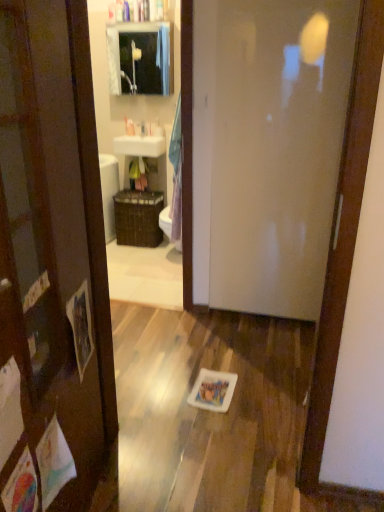
Question: Is white glossy toilet at center not within brown woven basket at center?

Choices:
 (A) yes
 (B) no

Answer: (A)

Question: Is white glossy toilet at center oriented away from brown woven basket at center?

Choices:
 (A) no
 (B) yes

Answer: (A)

Question: Can you confirm if white glossy toilet at center is thinner than brown woven basket at center?

Choices:
 (A) yes
 (B) no

Answer: (A)

Question: From a real-world perspective, is white glossy toilet at center positioned under brown woven basket at center based on gravity?

Choices:
 (A) yes
 (B) no

Answer: (A)

Question: Can you confirm if white glossy toilet at center is wider than brown woven basket at center?

Choices:
 (A) yes
 (B) no

Answer: (B)

Question: From a real-world perspective, is brown woven basket at center above or below white glossy door at center?

Choices:
 (A) below
 (B) above

Answer: (A)

Question: Is brown woven basket at center in front of or behind white glossy door at center in the image?

Choices:
 (A) front
 (B) behind

Answer: (B)

Question: In terms of width, does brown woven basket at center look wider or thinner when compared to white glossy door at center?

Choices:
 (A) wide
 (B) thin

Answer: (A)

Question: Is brown woven basket at center to the left or to the right of white glossy door at center in the image?

Choices:
 (A) left
 (B) right

Answer: (A)

Question: Considering the positions of matte glass mirror at upper center and white plastic cup at upper center, the 1th toiletry when ordered from right to left, in the image, is matte glass mirror at upper center taller or shorter than white plastic cup at upper center, the 1th toiletry when ordered from right to left,?

Choices:
 (A) tall
 (B) short

Answer: (A)

Question: From a real-world perspective, relative to white plastic cup at upper center, the 1th toiletry when ordered from right to left, is matte glass mirror at upper center vertically above or below?

Choices:
 (A) below
 (B) above

Answer: (B)

Question: Considering the positions of point (142, 29) and point (152, 129), is point (142, 29) closer or farther from the camera than point (152, 129)?

Choices:
 (A) farther
 (B) closer

Answer: (B)

Question: Considering their positions, is matte glass mirror at upper center located in front of or behind white plastic cup at upper center, the 1th toiletry when ordered from right to left?

Choices:
 (A) behind
 (B) front

Answer: (B)

Question: Visually, is white plastic cup at upper center, the 1th toiletry when ordered from right to left, positioned to the left or to the right of matte glass mirror at upper center?

Choices:
 (A) right
 (B) left

Answer: (A)

Question: Relative to matte glass mirror at upper center, is white plastic cup at upper center, the 1th toiletry when ordered from right to left, in front or behind?

Choices:
 (A) front
 (B) behind

Answer: (B)